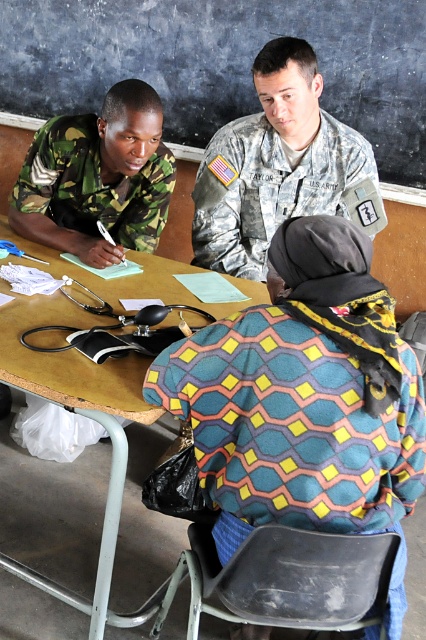
Question: Which is nearer to the camouflage uniform at center?

Choices:
 (A) camouflage fabric uniform at upper center
 (B) wooden table at center
 (C) camouflage fabric uniform at left

Answer: (C)

Question: Is camouflage uniform at center above camouflage fabric uniform at left?

Choices:
 (A) yes
 (B) no

Answer: (A)

Question: Which object is positioned closest to the wooden table at center?

Choices:
 (A) camouflage fabric uniform at left
 (B) camouflage fabric uniform at upper center
 (C) camouflage uniform at center

Answer: (A)

Question: Does camouflage uniform at center have a larger size compared to wooden table at center?

Choices:
 (A) no
 (B) yes

Answer: (A)

Question: Which of the following is the closest to the observer?

Choices:
 (A) camouflage uniform at center
 (B) wooden table at center

Answer: (B)

Question: Does camouflage fabric uniform at upper center have a lesser width compared to camouflage uniform at center?

Choices:
 (A) no
 (B) yes

Answer: (B)